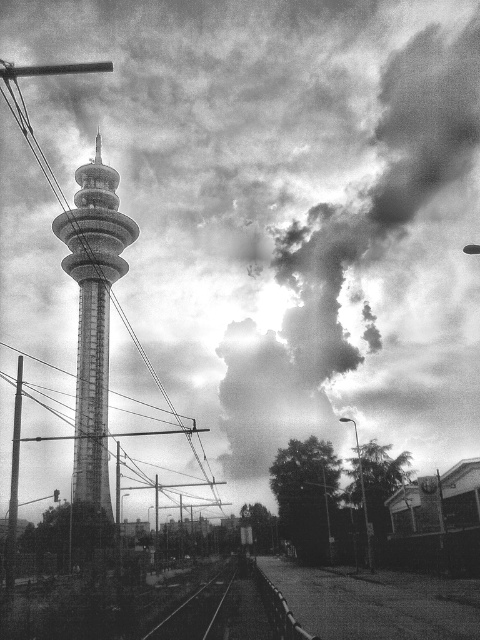
Is smooth wire at center shorter than smooth metal train track at lower center?

No, smooth wire at center is not shorter than smooth metal train track at lower center.

Who is lower down, smooth wire at center or smooth metal train track at lower center?

smooth metal train track at lower center

Is point (86, 429) farther from camera compared to point (204, 593)?

Yes, it is behind point (204, 593).

At what (x,y) coordinates should I click in order to perform the action: click on smooth wire at center. Please return your answer as a coordinate pair (x, y). Looking at the image, I should click on (87, 284).

Can you confirm if smooth metallic tower at center is thinner than smooth metal train track at lower center?

No, smooth metallic tower at center is not thinner than smooth metal train track at lower center.

Between smooth metallic tower at center and smooth metal train track at lower center, which one has more height?

smooth metallic tower at center is taller.

Who is more distant from viewer, [88,486] or [218,589]?

The point [88,486] is behind.

The image size is (480, 640). In order to click on smooth metallic tower at center in this screenshot , I will do `click(94, 314)`.

Describe the element at coordinates (87, 284) in the screenshot. I see `smooth wire at center` at that location.

The height and width of the screenshot is (640, 480). Find the location of `smooth wire at center`. smooth wire at center is located at coordinates (87, 284).

Identify the location of smooth wire at center. (87, 284).